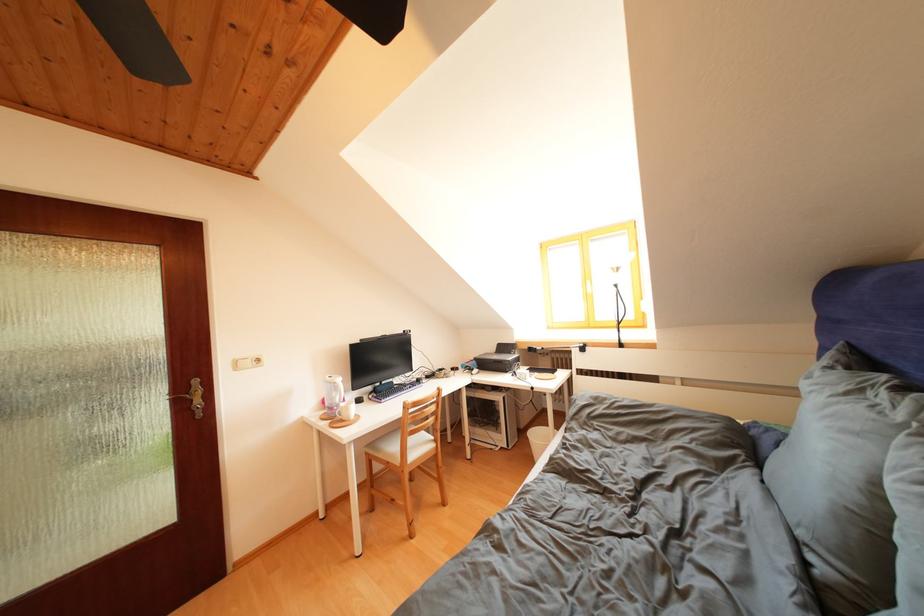
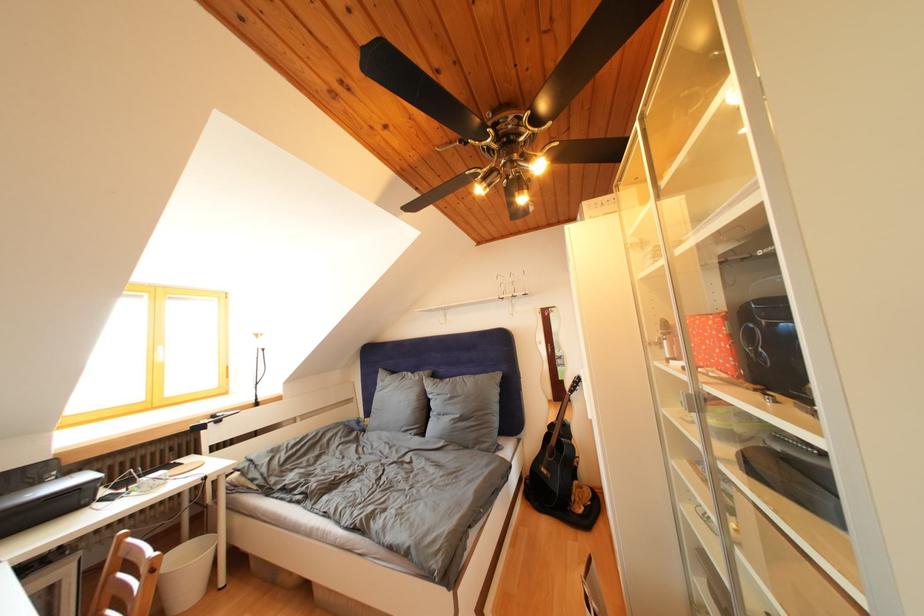
Where in the second image is the point corresponding to (x=517, y=358) from the first image?

(44, 488)